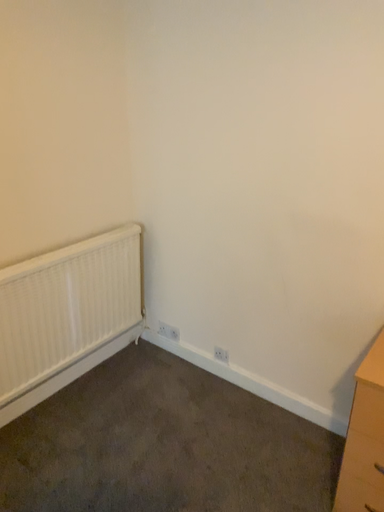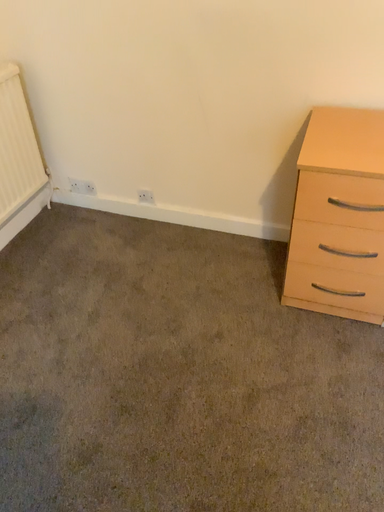
Question: Which way did the camera rotate in the video?

Choices:
 (A) rotated right
 (B) rotated left

Answer: (A)